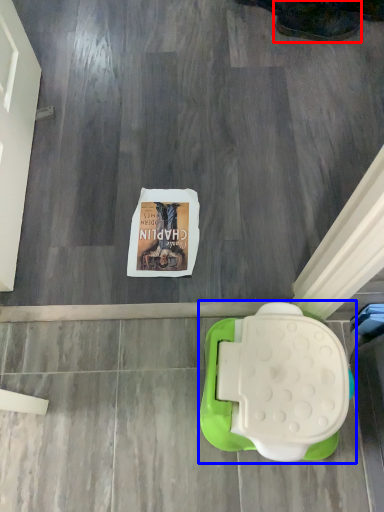
Question: Which object is closer to the camera taking this photo, footwear (highlighted by a red box) or toilet (highlighted by a blue box)?

Choices:
 (A) footwear
 (B) toilet

Answer: (B)